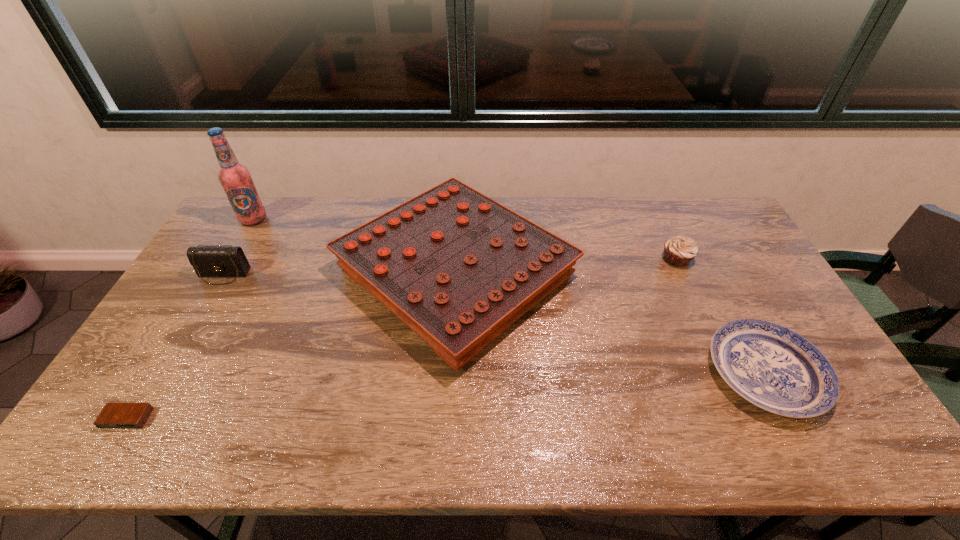
Where is `vacant region located 0.280m on the left of the plate`? vacant region located 0.280m on the left of the plate is located at coordinates (601, 373).

Image resolution: width=960 pixels, height=540 pixels. I want to click on alcohol positioned at the far edge, so click(235, 178).

Where is `gameboard located at the far edge`? Image resolution: width=960 pixels, height=540 pixels. gameboard located at the far edge is located at coordinates (458, 268).

Locate an element on the screen. Image resolution: width=960 pixels, height=540 pixels. plate that is at the near edge is located at coordinates (771, 366).

You are a GUI agent. You are given a task and a screenshot of the screen. Output one action in this format:
    pyautogui.click(x=<x>, y=<y>)
    Task: Click on the alarm clock situated at the near edge
    Image resolution: width=960 pixels, height=540 pixels.
    Given the screenshot: What is the action you would take?
    pyautogui.click(x=114, y=415)

This screenshot has height=540, width=960. Find the location of `alcohol present at the left edge`. alcohol present at the left edge is located at coordinates (235, 178).

This screenshot has height=540, width=960. Identify the location of clutch bag at the left edge. (211, 261).

Where is `alarm clock that is at the left edge`? alarm clock that is at the left edge is located at coordinates (114, 415).

Identify the location of object that is at the right edge. (771, 366).

I want to click on object that is at the far left corner, so click(x=235, y=178).